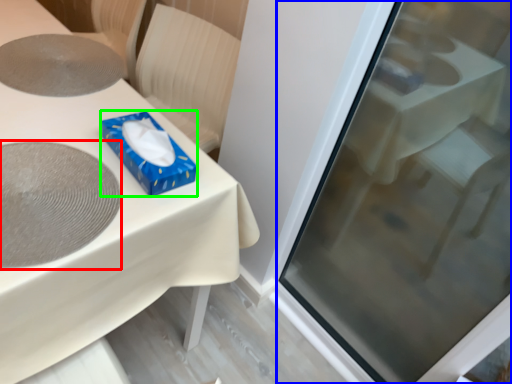
Question: Considering the real-world distances, which object is closest to oval (highlighted by a red box)? screen door (highlighted by a blue box) or box (highlighted by a green box).

Choices:
 (A) screen door
 (B) box

Answer: (B)